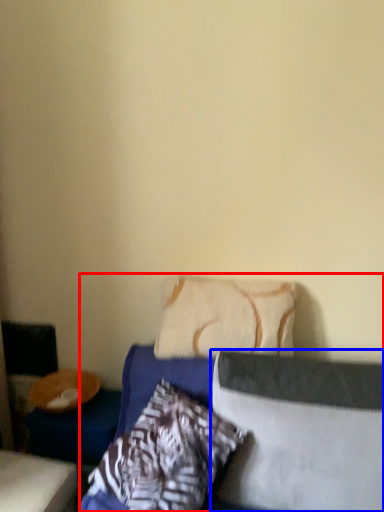
Question: Which object is further to the camera taking this photo, bed (highlighted by a red box) or pillow (highlighted by a blue box)?

Choices:
 (A) bed
 (B) pillow

Answer: (B)